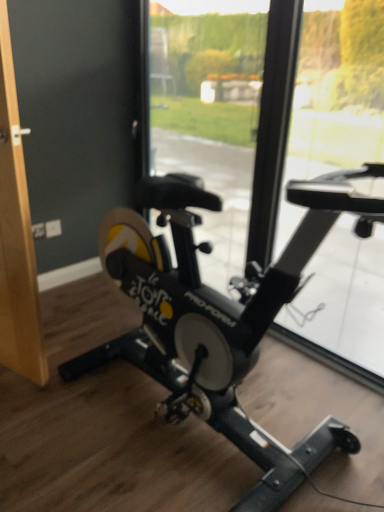
Identify the location of free space in front of wooden door handle at left. The image size is (384, 512). (21, 415).